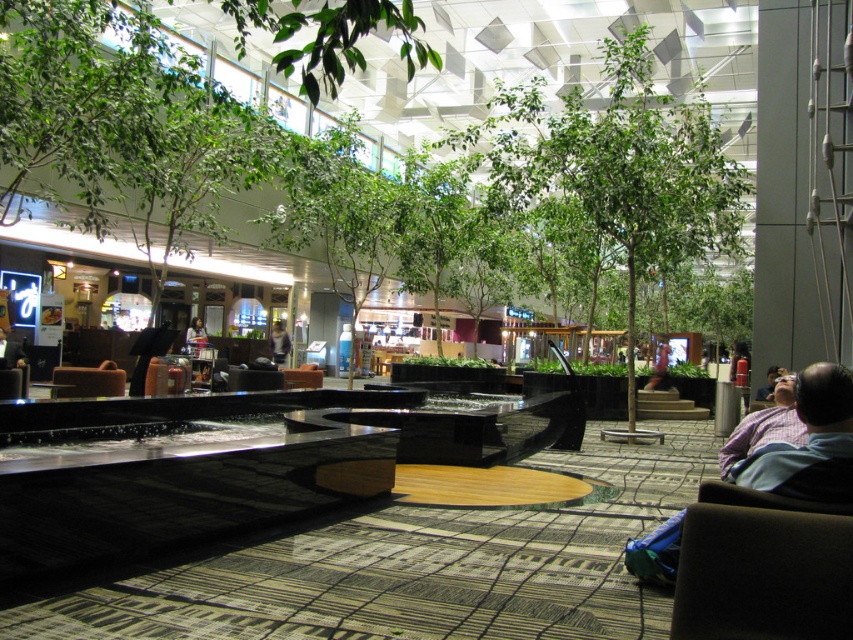
Question: Is brown leather armchair at center to the right of light brown leather jacket at center from the viewer's perspective?

Choices:
 (A) no
 (B) yes

Answer: (A)

Question: Which point is closer to the camera taking this photo?

Choices:
 (A) (769, 604)
 (B) (281, 339)

Answer: (A)

Question: Which of these objects is positioned farthest from the light brown leather jacket at center?

Choices:
 (A) purple cotton shirt at lower right
 (B) green leafy tree at center

Answer: (A)

Question: Is light brown leather jacket at center bigger than smooth leather jacket at center?

Choices:
 (A) no
 (B) yes

Answer: (B)

Question: Based on their relative distances, which object is nearer to the brown fabric armchair at lower right?

Choices:
 (A) smooth leather jacket at center
 (B) purple cotton shirt at lower right

Answer: (B)

Question: Can you confirm if purple cotton shirt at lower right is positioned to the left of brown leather armchair at center?

Choices:
 (A) yes
 (B) no

Answer: (B)